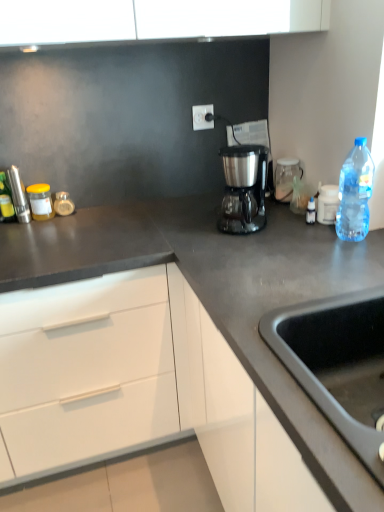
Question: Do you think brushed metal pepper mill at left, acting as the first appliance starting from the back, is within translucent glass jar at left, marked as the third bottle in a front-to-back arrangement, or outside of it?

Choices:
 (A) inside
 (B) outside

Answer: (B)

Question: In the image, is brushed metal pepper mill at left, which ranks as the first appliance in left-to-right order, positioned in front of or behind translucent glass jar at left, the 1th bottle when ordered from back to front?

Choices:
 (A) behind
 (B) front

Answer: (B)

Question: Based on their relative distances, which object is nearer to the black matte sink at lower right?

Choices:
 (A) matte yellow jar at left
 (B) dark gray matte countertop at center
 (C) metallic silver canister at left, placed as the third bottle when sorted from right to left
 (D) brushed metal pepper mill at left, acting as the first appliance starting from the back
 (E) white plastic electric outlet at upper center

Answer: (B)

Question: Based on their relative distances, which object is nearer to the transparent glass jar at upper right?

Choices:
 (A) transparent plastic bottle at right, marked as the 1th bottle in a right-to-left arrangement
 (B) satin metallic coffee maker at center
 (C) black matte sink at lower right
 (D) dark gray matte countertop at center
 (E) brushed metal pepper mill at left, acting as the first appliance starting from the back

Answer: (B)